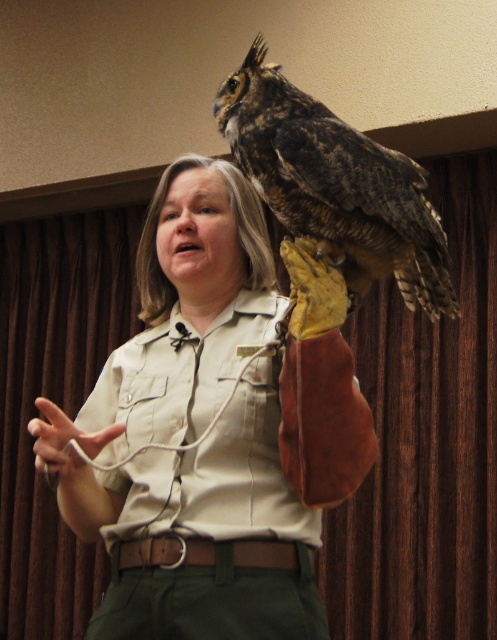
Based on the photo, does matte khaki shirt at lower left have a lesser width compared to white fabric hand at lower left?

Correct, matte khaki shirt at lower left's width is less than white fabric hand at lower left's.

Is matte khaki shirt at lower left smaller than white fabric hand at lower left?

Incorrect, matte khaki shirt at lower left is not smaller in size than white fabric hand at lower left.

Who is more forward, (62, 433) or (73, 458)?

Point (62, 433)

The image size is (497, 640). What are the coordinates of `matte khaki shirt at lower left` in the screenshot? It's located at (76, 470).

Between beige uniform at upper center and brown feathered owl at upper center, which one is positioned lower?

beige uniform at upper center is lower down.

Does point (248, 481) come closer to viewer compared to point (280, 218)?

No, (248, 481) is behind (280, 218).

Is point (169, 177) more distant than point (250, 150)?

Yes, it is.

Identify the location of beige uniform at upper center. (216, 433).

Can you confirm if leather glove at upper center is positioned to the left of white fabric hand at lower left?

In fact, leather glove at upper center is to the right of white fabric hand at lower left.

Can you confirm if leather glove at upper center is positioned above white fabric hand at lower left?

Yes, leather glove at upper center is above white fabric hand at lower left.

Does point (291, 332) lie in front of point (45, 404)?

No, it is behind (45, 404).

Identify the location of leather glove at upper center. (314, 288).